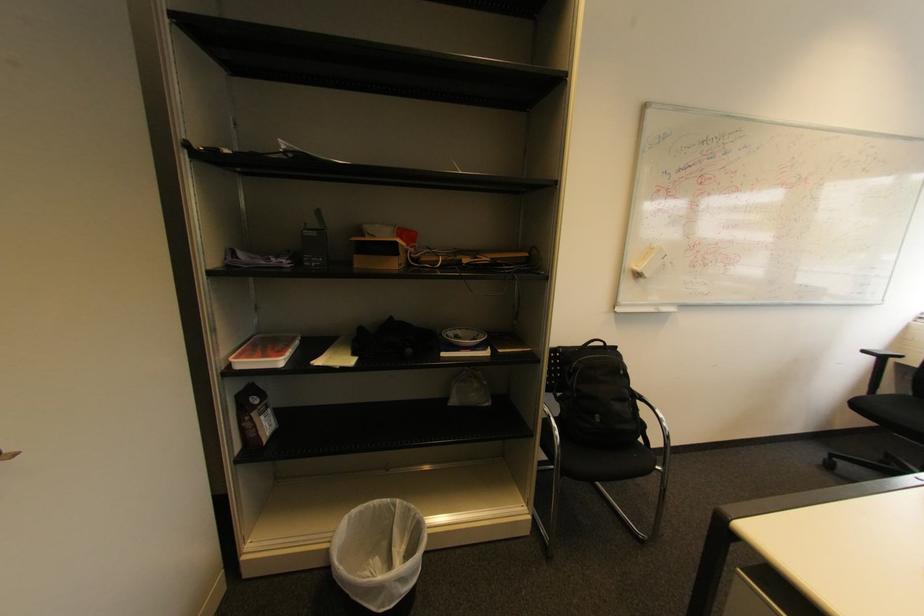
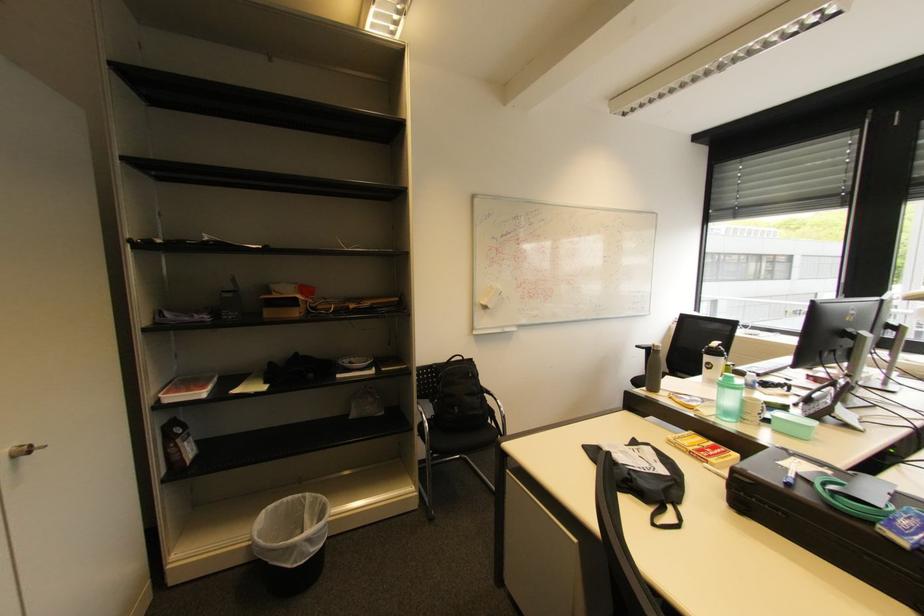
Question: Which direction would the cameraman need to move to produce the second image? Reply with the corresponding letter.

Choices:
 (A) Left
 (B) Right
 (C) Forward
 (D) Backward

Answer: (D)